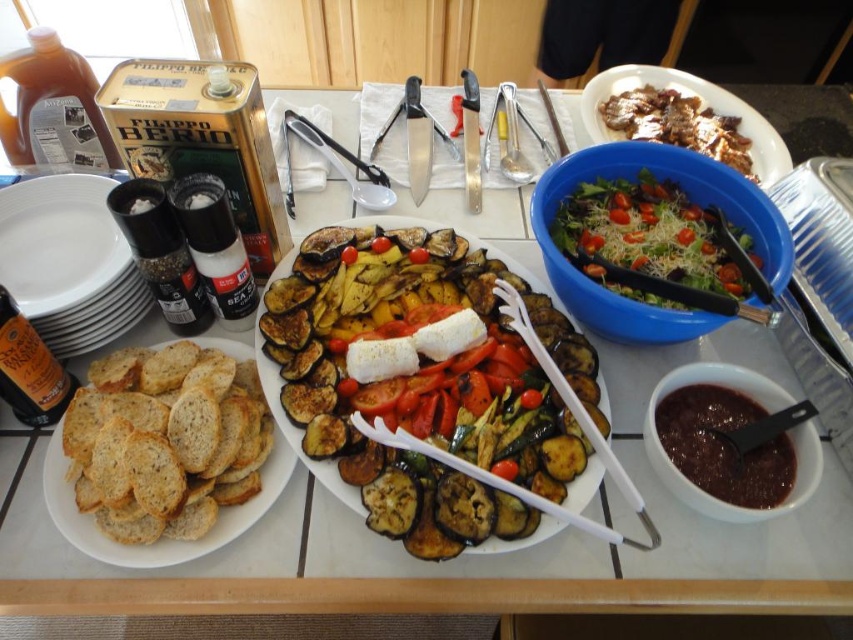
Can you confirm if white ceramic plate at left is bigger than matte brown bowl at lower right?

No.

Does point (25, 310) come behind point (807, 472)?

That is True.

You are a GUI agent. You are given a task and a screenshot of the screen. Output one action in this format:
    pyautogui.click(x=<x>, y=<y>)
    Task: Click on the white ceramic plate at left
    Image resolution: width=853 pixels, height=640 pixels.
    Given the screenshot: What is the action you would take?
    pyautogui.click(x=57, y=241)

Can you confirm if brown crumbly bread at left is positioned below matte brown bowl at lower right?

No, brown crumbly bread at left is not below matte brown bowl at lower right.

Which is in front, point (199, 547) or point (735, 376)?

Point (199, 547) is in front.

This screenshot has width=853, height=640. Find the location of `brown crumbly bread at left`. brown crumbly bread at left is located at coordinates (160, 538).

Is point (51, 476) closer to camera compared to point (766, 154)?

Yes.

Can you confirm if brown crumbly bread at left is shorter than green leafy salad at upper right?

Yes.

Is point (65, 540) positioned behind point (595, 104)?

No.

Identify the location of brown crumbly bread at left. (160, 538).